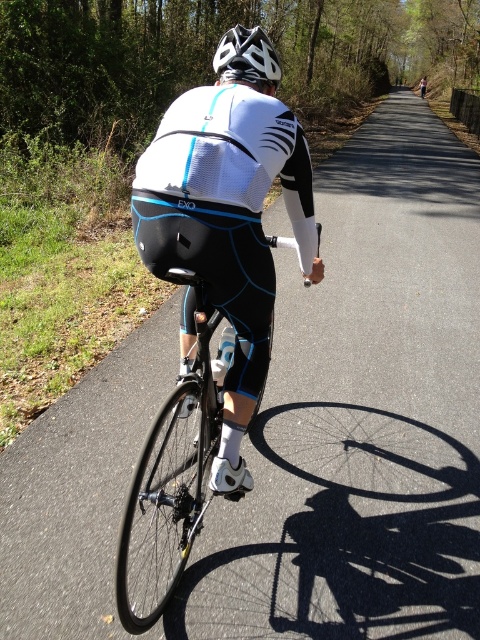
Question: Which object is closer to the camera taking this photo?

Choices:
 (A) white matte bicycle helmet at center
 (B) shiny black frame at center

Answer: (B)

Question: Can you confirm if shiny black frame at center is smaller than white matte bicycle helmet at center?

Choices:
 (A) no
 (B) yes

Answer: (A)

Question: Can you confirm if shiny black frame at center is wider than white matte bicycle helmet at center?

Choices:
 (A) no
 (B) yes

Answer: (B)

Question: Is shiny black frame at center to the right of white matte bicycle helmet at center from the viewer's perspective?

Choices:
 (A) no
 (B) yes

Answer: (A)